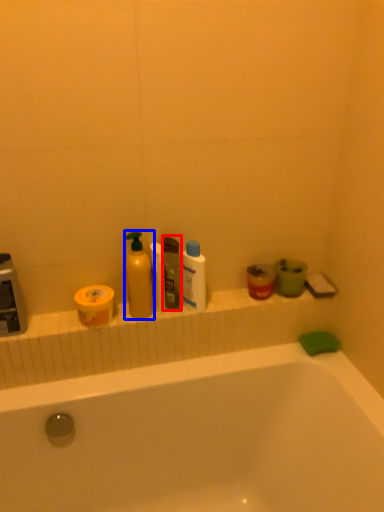
Question: Which of the following is the closest to the observer, toiletry (highlighted by a red box) or cleaning product (highlighted by a blue box)?

Choices:
 (A) toiletry
 (B) cleaning product

Answer: (B)